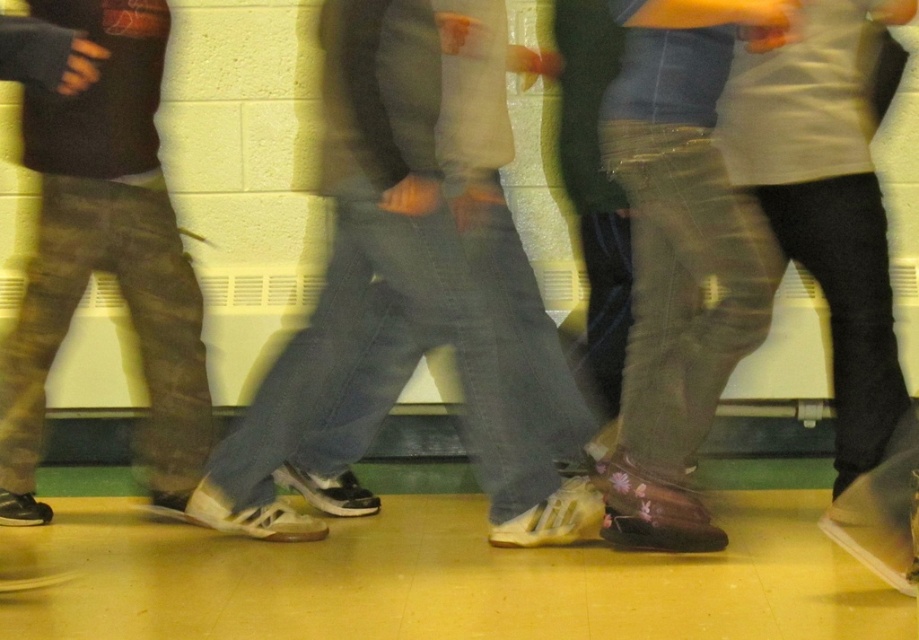
Question: Among these objects, which one is nearest to the camera?

Choices:
 (A) white matte sneakers at center
 (B) floral leather boots at center

Answer: (B)

Question: Is floral leather boots at center smaller than camouflage pants at left?

Choices:
 (A) yes
 (B) no

Answer: (B)

Question: Which point is closer to the camera?

Choices:
 (A) floral leather boots at center
 (B) camouflage pants at left

Answer: (A)

Question: Is white matte sneakers at center smaller than camouflage pants at left?

Choices:
 (A) no
 (B) yes

Answer: (A)

Question: Is white matte sneakers at center in front of camouflage pants at left?

Choices:
 (A) yes
 (B) no

Answer: (A)

Question: Which of the following is the closest to the observer?

Choices:
 (A) (611, 524)
 (B) (168, 504)
 (C) (399, 177)

Answer: (C)